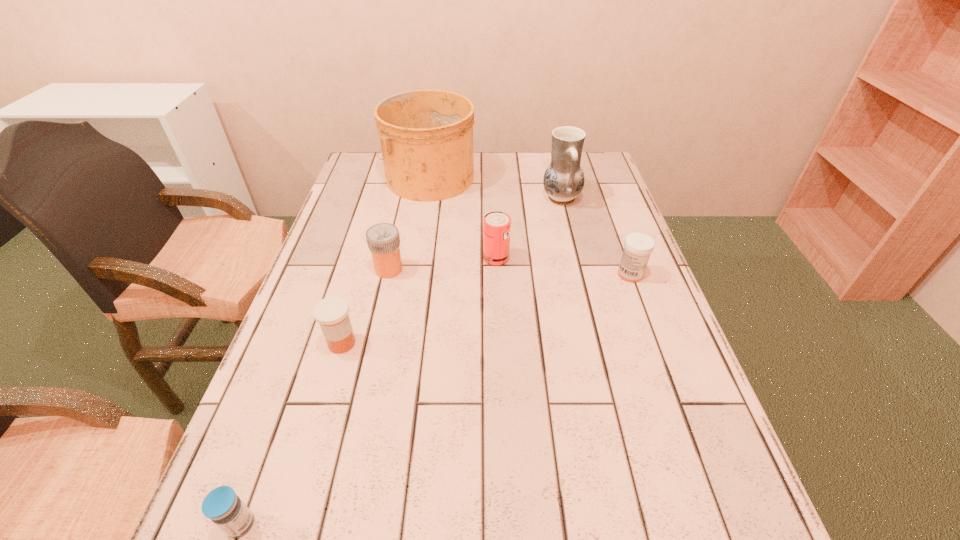
Where is `object at the near left corner`? The image size is (960, 540). object at the near left corner is located at coordinates (221, 505).

You are a GUI agent. You are given a task and a screenshot of the screen. Output one action in this format:
    pyautogui.click(x=<x>, y=<y>)
    Task: Click on the object at the far right corner
    The height and width of the screenshot is (540, 960).
    Given the screenshot: What is the action you would take?
    pyautogui.click(x=563, y=181)

In the image, there is a desktop. What are the coordinates of `free space at the far edge` in the screenshot? It's located at pos(495,183).

This screenshot has width=960, height=540. In the image, there is a desktop. Find the location of `vacant space at the left edge`. vacant space at the left edge is located at coordinates (325, 464).

Find the location of a particular element. This screenshot has width=960, height=540. free space at the right edge is located at coordinates (619, 312).

At what (x,y) coordinates should I click in order to perform the action: click on free point at the far left corner. Please return your answer as a coordinate pair (x, y). The width and height of the screenshot is (960, 540). Looking at the image, I should click on (363, 159).

This screenshot has height=540, width=960. I want to click on free spot between the shortest object and the can, so click(369, 391).

You are a GUI agent. You are given a task and a screenshot of the screen. Output one action in this format:
    pyautogui.click(x=<x>, y=<y>)
    Task: Click on the vacant point located between the second nearest medicine and the nearest medicine
    The image size is (960, 540).
    Given the screenshot: What is the action you would take?
    pyautogui.click(x=291, y=434)

Where is `free space between the sixth farthest object and the rightmost medicine`? The width and height of the screenshot is (960, 540). free space between the sixth farthest object and the rightmost medicine is located at coordinates (486, 309).

Where is `vacant point located between the second nearest medicine and the can`? The height and width of the screenshot is (540, 960). vacant point located between the second nearest medicine and the can is located at coordinates (419, 301).